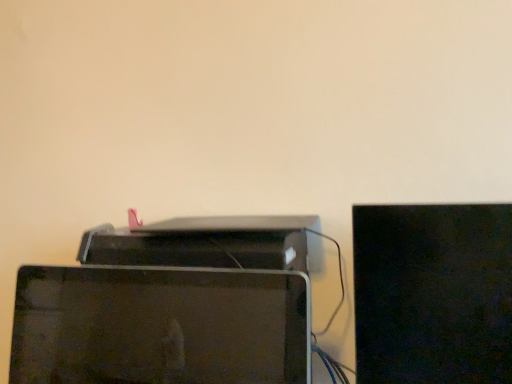
What do you see at coordinates (159, 326) in the screenshot?
I see `matte black monitor at center` at bounding box center [159, 326].

Measure the distance between matte black monitor at center and camera.

The depth of matte black monitor at center is 61.01 centimeters.

What are the coordinates of `matte black monitor at center` in the screenshot? It's located at (159, 326).

At what (x,y) coordinates should I click in order to perform the action: click on matte black monitor at center. Please return your answer as a coordinate pair (x, y). The height and width of the screenshot is (384, 512). Looking at the image, I should click on (159, 326).